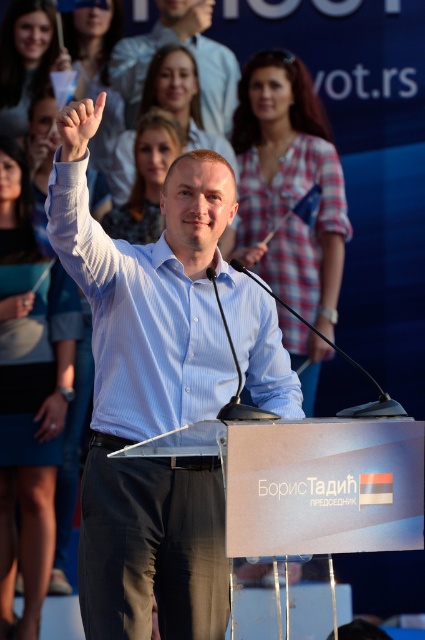
Question: Which point is closer to the camera?

Choices:
 (A) (132, 541)
 (B) (125, 38)
 (C) (2, 353)
 (D) (31, 83)

Answer: (A)

Question: Which of the following is the closest to the observer?

Choices:
 (A) (68, 52)
 (B) (8, 83)
 (C) (45, 428)

Answer: (C)

Question: Is blue denim skirt at lower left to the right of matte black hand at upper left from the viewer's perspective?

Choices:
 (A) yes
 (B) no

Answer: (B)

Question: Is plaid fabric shirt at upper center bigger than matte blue shirt at upper left?

Choices:
 (A) yes
 (B) no

Answer: (A)

Question: Which object is farther from the camera taking this photo?

Choices:
 (A) blue denim skirt at lower left
 (B) matte black hand at upper left
 (C) matte blue shirt at center

Answer: (C)

Question: Is plaid fabric shirt at upper center above matte blue shirt at upper left?

Choices:
 (A) no
 (B) yes

Answer: (A)